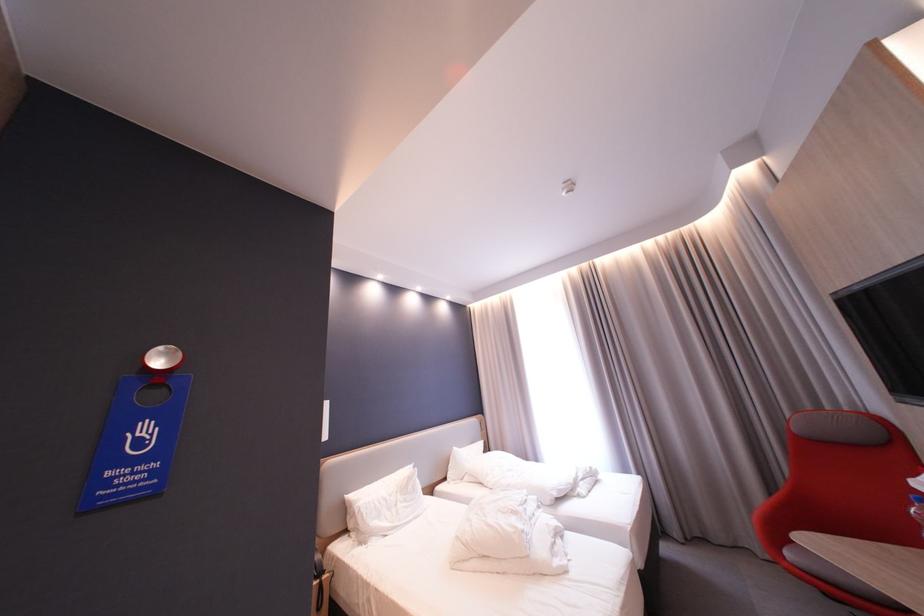
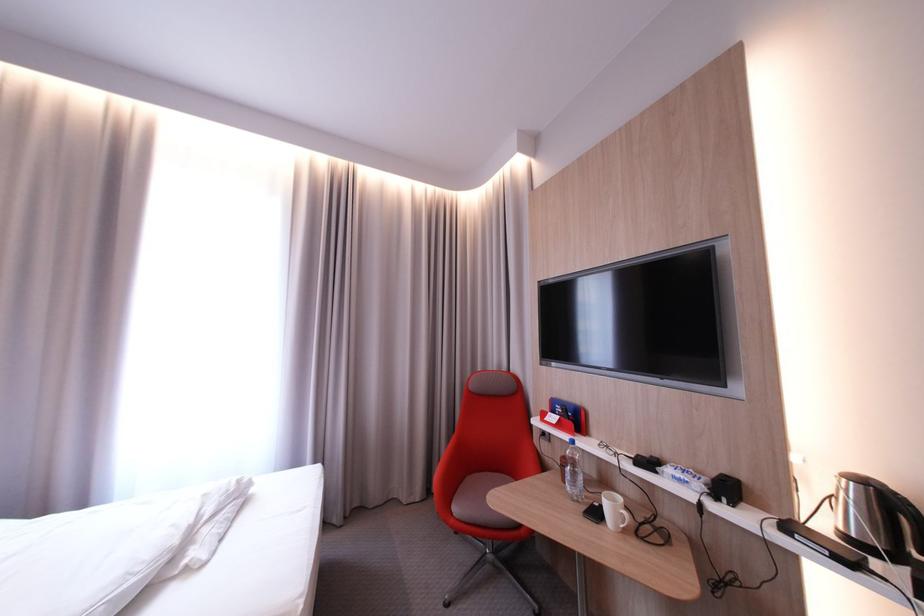
The point at (588, 469) is marked in the first image. Where is the corresponding point in the second image?

(215, 496)